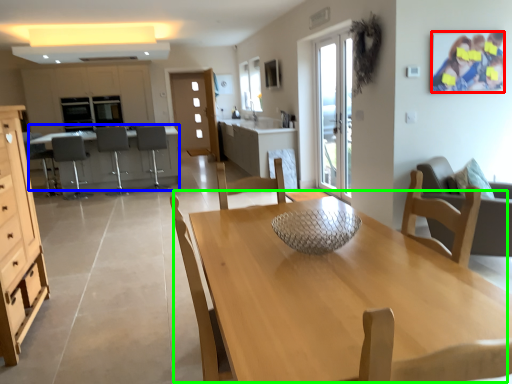
Question: Estimate the real-world distances between objects in this image. Which object is farther from couple (highlighted by a red box), desk (highlighted by a blue box) or kitchen & dining room table (highlighted by a green box)?

Choices:
 (A) desk
 (B) kitchen & dining room table

Answer: (A)